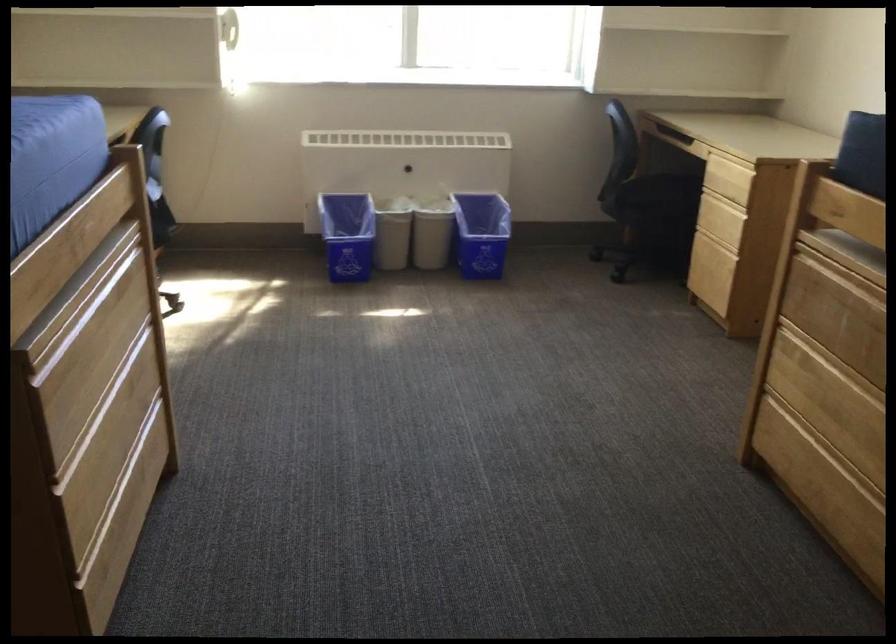
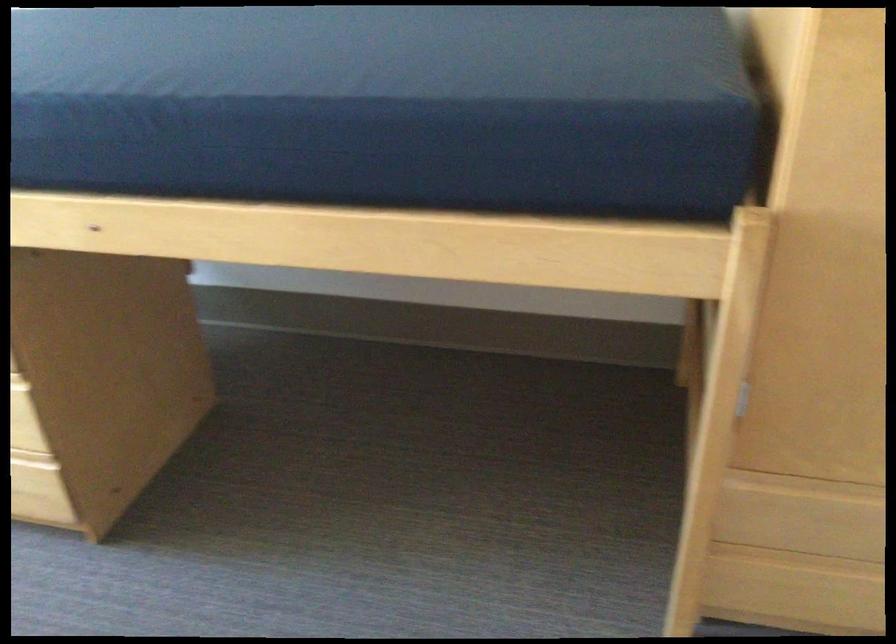
The first image is from the beginning of the video and the second image is from the end. How did the camera likely rotate when shooting the video?

The camera's rotation is toward right-down.